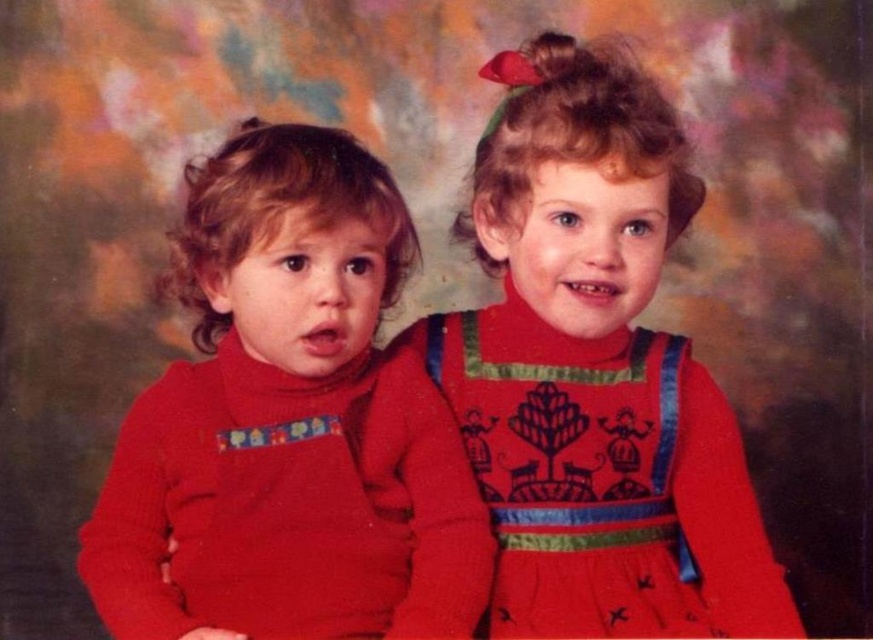
Question: Observing the image, what is the correct spatial positioning of matte red sweater at left in reference to matte red dress at upper right?

Choices:
 (A) right
 (B) left

Answer: (B)

Question: Which point is closer to the camera taking this photo?

Choices:
 (A) (373, 612)
 (B) (555, 214)

Answer: (A)

Question: Does matte red sweater at left appear on the right side of matte red dress at upper right?

Choices:
 (A) yes
 (B) no

Answer: (B)

Question: Is matte red sweater at left smaller than matte red dress at upper right?

Choices:
 (A) no
 (B) yes

Answer: (B)